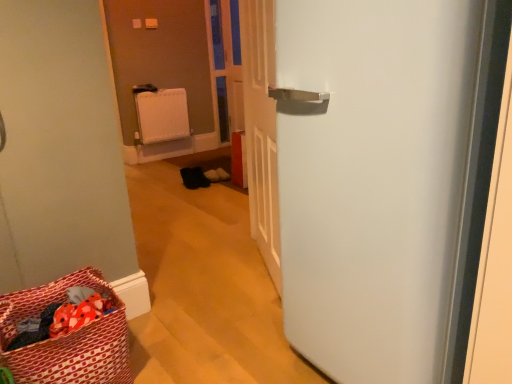
Question: Considering the relative sizes of white matte refrigerator at right and red fabric laundry basket at lower left in the image provided, is white matte refrigerator at right taller than red fabric laundry basket at lower left?

Choices:
 (A) yes
 (B) no

Answer: (A)

Question: Is white matte refrigerator at right bigger than red fabric laundry basket at lower left?

Choices:
 (A) no
 (B) yes

Answer: (B)

Question: Is white matte refrigerator at right facing towards red fabric laundry basket at lower left?

Choices:
 (A) yes
 (B) no

Answer: (B)

Question: Would you say red fabric laundry basket at lower left is part of white matte refrigerator at right's contents?

Choices:
 (A) yes
 (B) no

Answer: (B)

Question: Is white matte refrigerator at right outside red fabric laundry basket at lower left?

Choices:
 (A) no
 (B) yes

Answer: (B)

Question: Relative to red fabric laundry basket at lower left, is white matte refrigerator at right in front or behind?

Choices:
 (A) behind
 (B) front

Answer: (B)

Question: In terms of size, does white matte refrigerator at right appear bigger or smaller than red fabric laundry basket at lower left?

Choices:
 (A) big
 (B) small

Answer: (A)

Question: In terms of width, does white matte refrigerator at right look wider or thinner when compared to red fabric laundry basket at lower left?

Choices:
 (A) wide
 (B) thin

Answer: (A)

Question: From their relative heights in the image, would you say white matte refrigerator at right is taller or shorter than red fabric laundry basket at lower left?

Choices:
 (A) tall
 (B) short

Answer: (A)

Question: Based on their positions, is white matte refrigerator at right located to the left or right of transparent plastic screen door at center?

Choices:
 (A) right
 (B) left

Answer: (A)

Question: Is white matte refrigerator at right situated inside transparent plastic screen door at center or outside?

Choices:
 (A) inside
 (B) outside

Answer: (B)

Question: From a real-world perspective, is white matte refrigerator at right above or below transparent plastic screen door at center?

Choices:
 (A) above
 (B) below

Answer: (B)

Question: From the image's perspective, relative to transparent plastic screen door at center, is white matte refrigerator at right above or below?

Choices:
 (A) below
 (B) above

Answer: (A)

Question: Is transparent plastic screen door at center situated inside red fabric laundry basket at lower left or outside?

Choices:
 (A) inside
 (B) outside

Answer: (B)

Question: Relative to red fabric laundry basket at lower left, is transparent plastic screen door at center in front or behind?

Choices:
 (A) front
 (B) behind

Answer: (B)